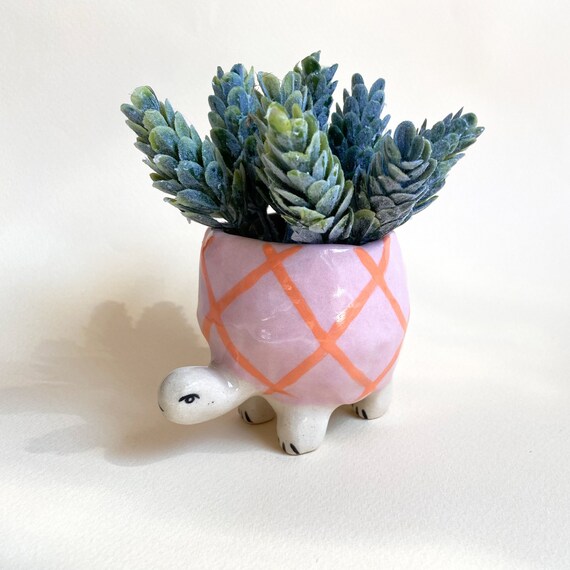
This screenshot has height=570, width=570. I want to click on reflection of light on pot, so click(335, 317), click(336, 253), click(337, 291).